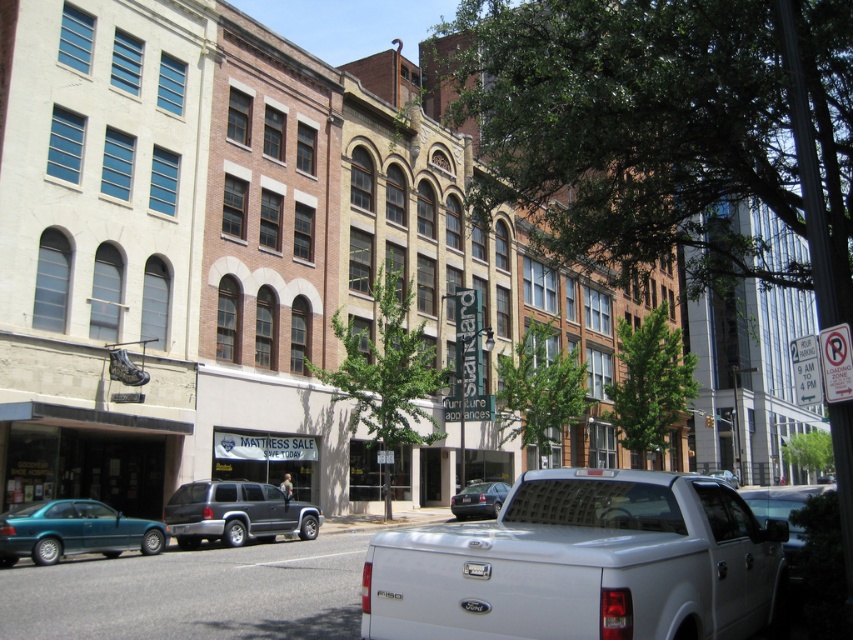
You are standing on the street looking at the row of buildings. There are two points marked on the buildings. One is at point (70, 529) and the other is at point (485, 488). Which point is closer to you?

Point (70, 529) is closer to the viewer than point (485, 488).

You are a delivery driver who needs to back out of a parking spot between the metallic silver truck at right and the shiny black sedan at center. Can you safely do so without hitting either vehicle?

The metallic silver truck at right is positioned under the shiny black sedan at center, meaning the truck is parked behind the sedan. Since the truck is behind the sedan, you can safely back out from between them without hitting either vehicle.